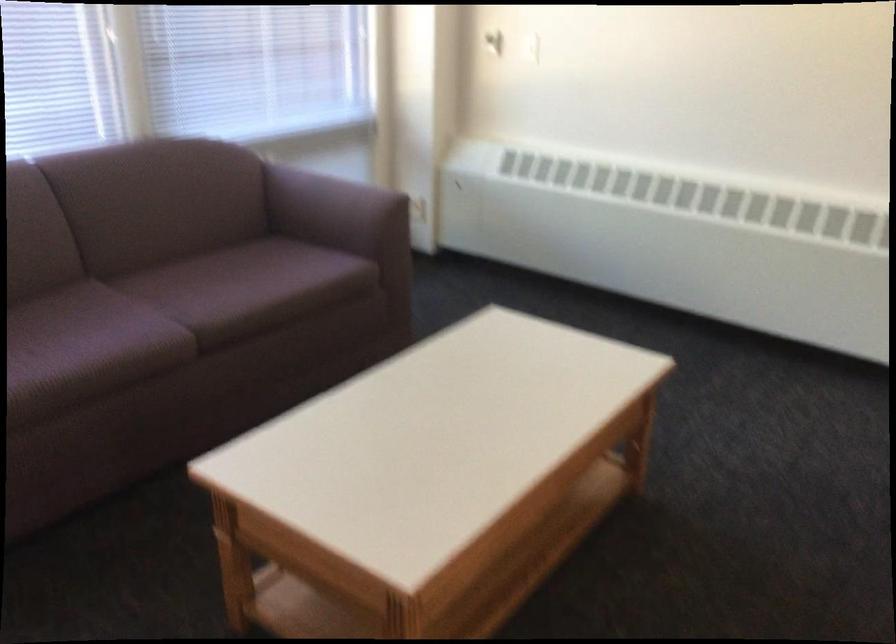
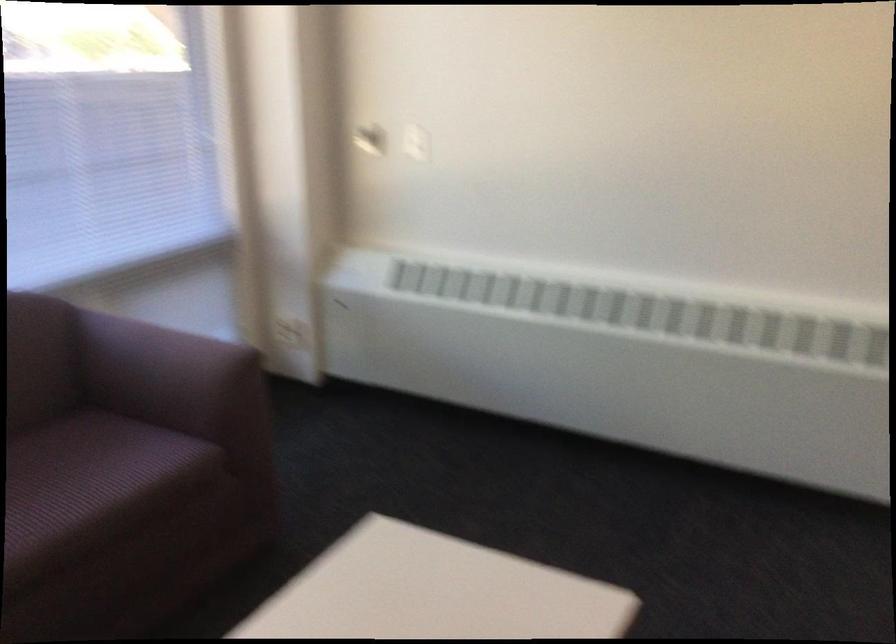
Question: The first image is from the beginning of the video and the second image is from the end. How did the camera likely rotate when shooting the video?

Choices:
 (A) Left
 (B) Right
 (C) Up
 (D) Down

Answer: (B)